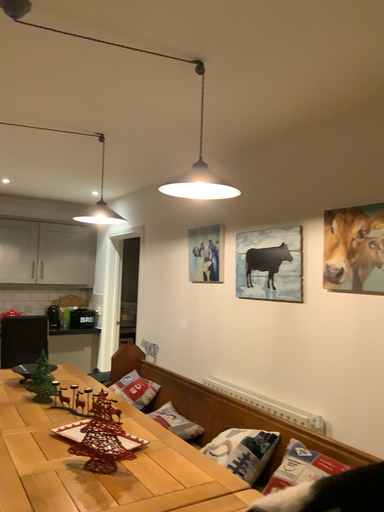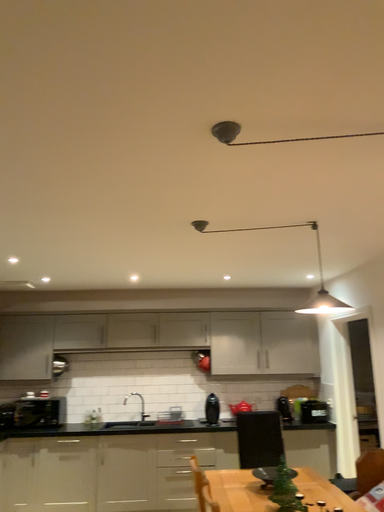
Question: Which way did the camera rotate in the video?

Choices:
 (A) rotated downward
 (B) rotated upward

Answer: (B)